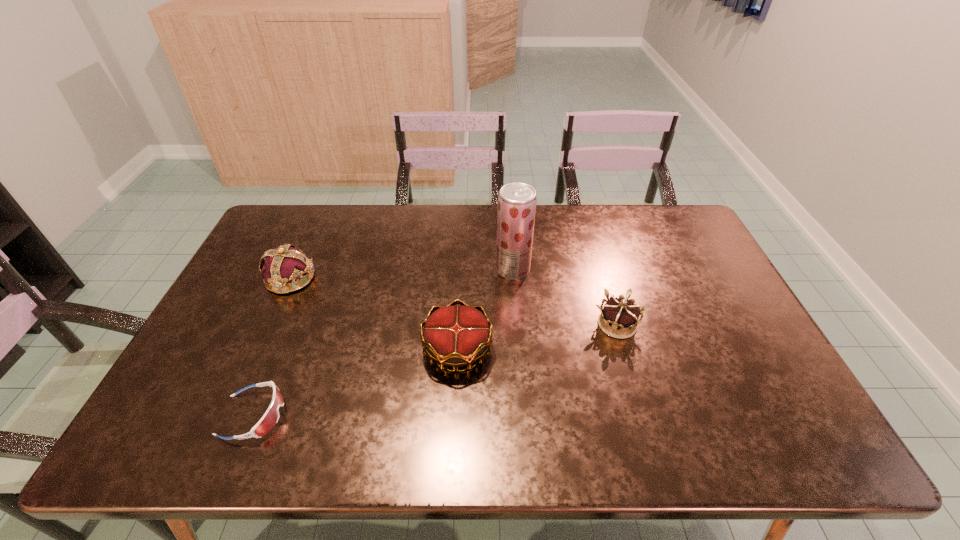
Find the location of a particular element. This screenshot has height=540, width=960. fruit juice is located at coordinates (517, 201).

Locate an element on the screen. This screenshot has height=540, width=960. the second object from right to left is located at coordinates (517, 201).

Where is `the fourth shortest object`? the fourth shortest object is located at coordinates (285, 264).

Locate an element on the screen. The height and width of the screenshot is (540, 960). the farthest crown is located at coordinates (285, 264).

At what (x,y) coordinates should I click in order to perform the action: click on the third object from right to left. Please return your answer as a coordinate pair (x, y). This screenshot has height=540, width=960. Looking at the image, I should click on (455, 336).

Find the location of a particular element. The height and width of the screenshot is (540, 960). the rightmost object is located at coordinates (619, 317).

Where is `the nearest object`? The width and height of the screenshot is (960, 540). the nearest object is located at coordinates (270, 418).

Locate an element on the screen. goggles is located at coordinates (270, 418).

You are a GUI agent. You are given a task and a screenshot of the screen. Output one action in this format:
    pyautogui.click(x=<x>, y=<y>)
    Task: Click on the vacant area located 0.270m on the right of the second object from right to left
    This screenshot has height=540, width=960.
    Given the screenshot: What is the action you would take?
    pyautogui.click(x=614, y=269)

Locate an element on the screen. This screenshot has width=960, height=540. vacant region located on the right of the farthest crown is located at coordinates (439, 279).